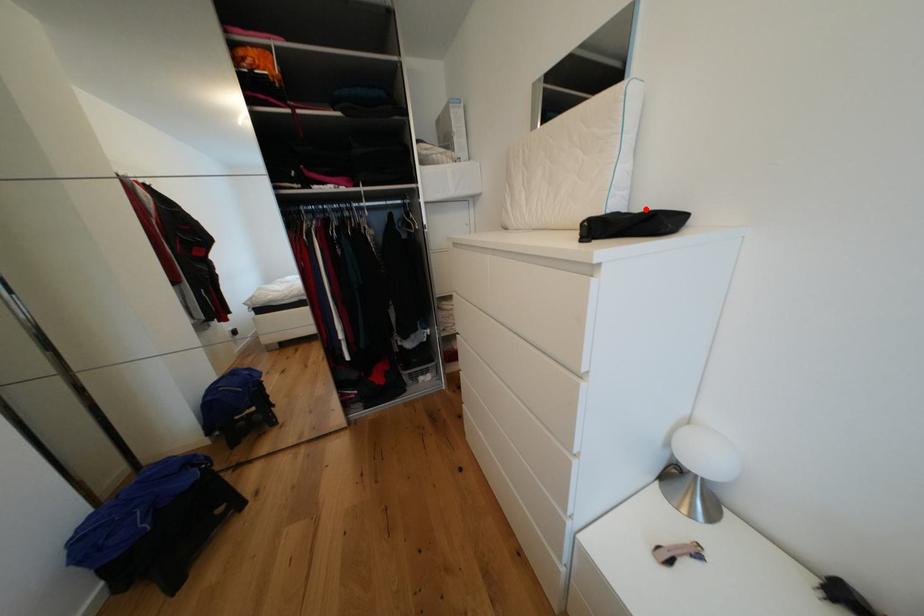
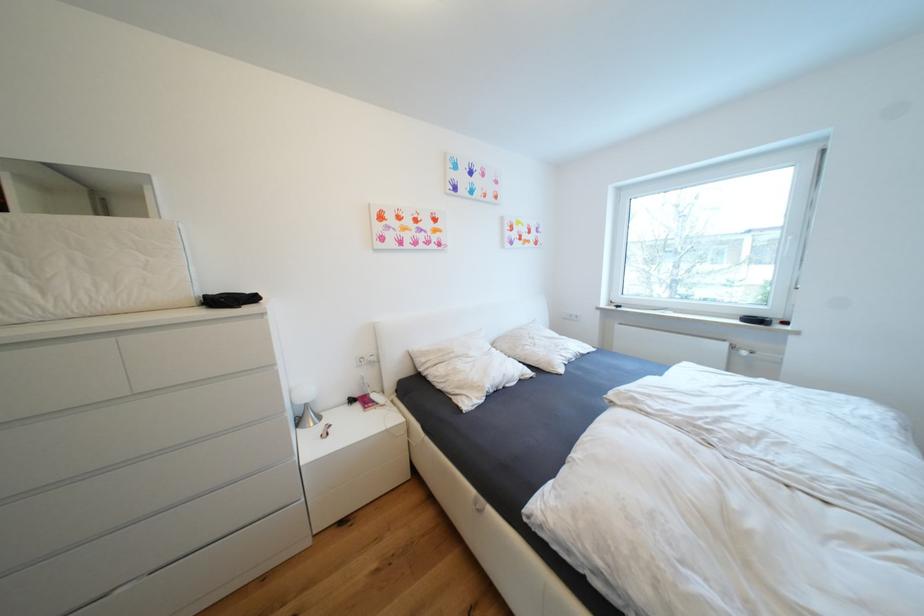
In the second image, find the point that corresponds to the highlighted location in the first image.

(222, 294)